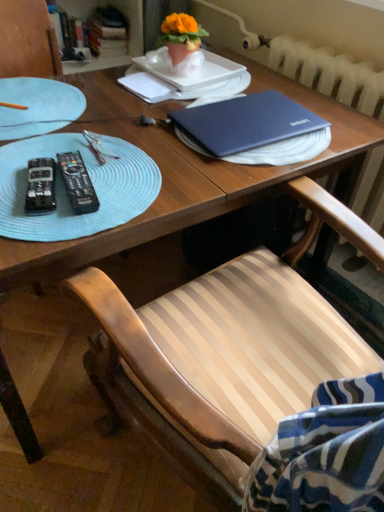
Question: Are matte blue laptop at center and hardcover book at upper left, which appears as the 2th book when viewed from the right, located far from each other?

Choices:
 (A) yes
 (B) no

Answer: (A)

Question: Is matte blue laptop at center oriented towards hardcover book at upper left, which appears as the 2th book when viewed from the right?

Choices:
 (A) yes
 (B) no

Answer: (B)

Question: Is matte blue laptop at center facing away from hardcover book at upper left, which appears as the 2th book when viewed from the right?

Choices:
 (A) yes
 (B) no

Answer: (B)

Question: Considering the relative sizes of matte blue laptop at center and hardcover book at upper left, which appears as the 2th book when viewed from the right, in the image provided, is matte blue laptop at center shorter than hardcover book at upper left, which appears as the 2th book when viewed from the right,?

Choices:
 (A) no
 (B) yes

Answer: (B)

Question: Is matte blue laptop at center not within hardcover book at upper left, which appears as the 2th book when viewed from the right?

Choices:
 (A) yes
 (B) no

Answer: (A)

Question: Considering the relative positions of matte blue laptop at center and hardcover book at upper left, which appears as the 2th book when viewed from the right, in the image provided, is matte blue laptop at center to the left of hardcover book at upper left, which appears as the 2th book when viewed from the right, from the viewer's perspective?

Choices:
 (A) no
 (B) yes

Answer: (A)

Question: From the image's perspective, would you say black plastic remote control at left, the 2th remote control when ordered from right to left, is shown under matte blue laptop at center?

Choices:
 (A) no
 (B) yes

Answer: (B)

Question: Is black plastic remote control at left, the 2th remote control when ordered from right to left, far from matte blue laptop at center?

Choices:
 (A) no
 (B) yes

Answer: (A)

Question: Does black plastic remote control at left, the 2th remote control when ordered from right to left, have a lesser height compared to matte blue laptop at center?

Choices:
 (A) no
 (B) yes

Answer: (B)

Question: Does black plastic remote control at left, which appears as the 1th remote control when viewed from the left, have a lesser width compared to matte blue laptop at center?

Choices:
 (A) no
 (B) yes

Answer: (B)

Question: Can you confirm if black plastic remote control at left, the 2th remote control when ordered from right to left, is taller than matte blue laptop at center?

Choices:
 (A) no
 (B) yes

Answer: (A)

Question: Is black plastic remote control at left, which appears as the 1th remote control when viewed from the left, to the right of matte blue laptop at center from the viewer's perspective?

Choices:
 (A) no
 (B) yes

Answer: (A)

Question: Considering the relative sizes of light blue textured glass plate at left, the second glass plate when ordered from bottom to top, and white textured radiator at upper right in the image provided, is light blue textured glass plate at left, the second glass plate when ordered from bottom to top, shorter than white textured radiator at upper right?

Choices:
 (A) no
 (B) yes

Answer: (B)